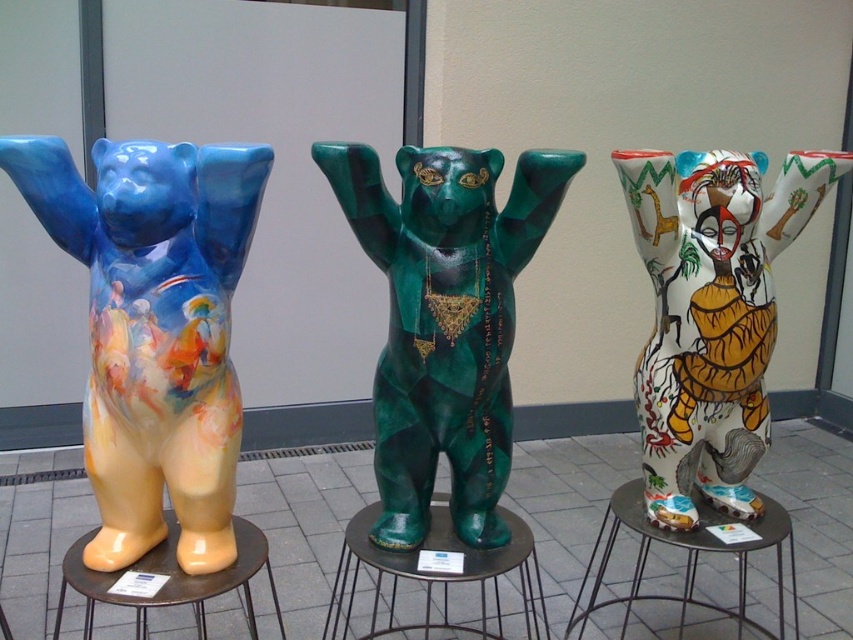
Question: Which point is farther from the camera taking this photo?

Choices:
 (A) (434, 522)
 (B) (697, 538)
 (C) (132, 600)
 (D) (642, 435)

Answer: (D)

Question: Can you confirm if hand-painted ceramic bear at center is positioned to the right of metallic gray side table at center?

Choices:
 (A) yes
 (B) no

Answer: (B)

Question: Does matte ceramic bear at left come in front of brown glossy stool at lower left?

Choices:
 (A) yes
 (B) no

Answer: (A)

Question: Can you confirm if hand-painted ceramic bear at center is thinner than green glossy boot at center?

Choices:
 (A) yes
 (B) no

Answer: (A)

Question: Among these objects, which one is farthest from the camera?

Choices:
 (A) green glossy boot at center
 (B) metallic gray side table at center
 (C) matte ceramic bear at left

Answer: (B)

Question: Among these objects, which one is farthest from the camera?

Choices:
 (A) matte ceramic bear at left
 (B) green glossy boot at center
 (C) hand-painted ceramic bear at center
 (D) green glossy bear at center

Answer: (C)